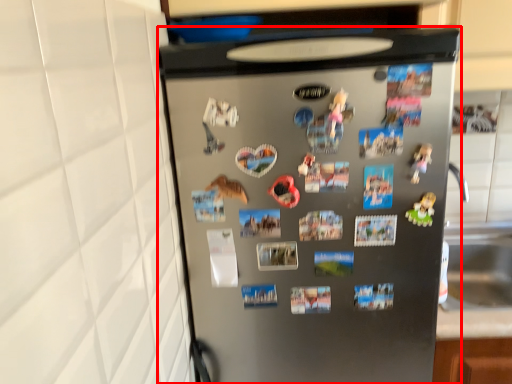
Question: Observing the image, what is the correct spatial positioning of refrigerator (annotated by the red box) in reference to toy?

Choices:
 (A) right
 (B) left

Answer: (B)